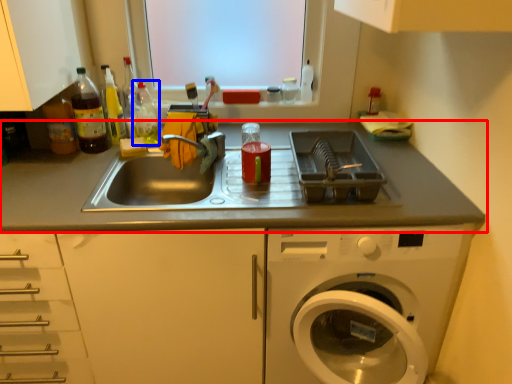
Question: Which object is closer to the camera taking this photo, countertop (highlighted by a red box) or bottle (highlighted by a blue box)?

Choices:
 (A) countertop
 (B) bottle

Answer: (A)